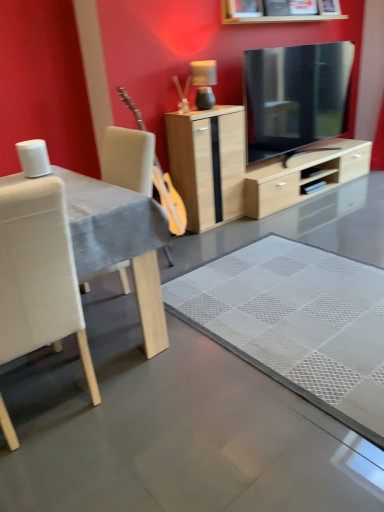
Question: Is matte gray lamp at center smaller than white fabric chair at left?

Choices:
 (A) yes
 (B) no

Answer: (A)

Question: Does matte gray lamp at center lie behind white fabric chair at left?

Choices:
 (A) no
 (B) yes

Answer: (B)

Question: From a real-world perspective, is matte gray lamp at center positioned under white fabric chair at left based on gravity?

Choices:
 (A) no
 (B) yes

Answer: (A)

Question: From a real-world perspective, does matte gray lamp at center stand above white fabric chair at left?

Choices:
 (A) yes
 (B) no

Answer: (A)

Question: Can you see matte gray lamp at center touching white fabric chair at left?

Choices:
 (A) no
 (B) yes

Answer: (A)

Question: Is matte gray lamp at center oriented away from white fabric chair at left?

Choices:
 (A) no
 (B) yes

Answer: (A)

Question: Considering the relative sizes of white fabric chair at left and matte gray lamp at center in the image provided, is white fabric chair at left thinner than matte gray lamp at center?

Choices:
 (A) no
 (B) yes

Answer: (A)

Question: Is matte gray lamp at center at the back of white fabric chair at left?

Choices:
 (A) no
 (B) yes

Answer: (A)

Question: Is white fabric chair at left far from matte gray lamp at center?

Choices:
 (A) yes
 (B) no

Answer: (A)

Question: Is white fabric chair at left wider than matte gray lamp at center?

Choices:
 (A) yes
 (B) no

Answer: (A)

Question: From a real-world perspective, does white fabric chair at left sit lower than matte gray lamp at center?

Choices:
 (A) yes
 (B) no

Answer: (A)

Question: Is the depth of white fabric chair at left greater than that of matte gray lamp at center?

Choices:
 (A) no
 (B) yes

Answer: (A)

Question: From a real-world perspective, is white fabric table at left on top of white fabric chair at left?

Choices:
 (A) yes
 (B) no

Answer: (A)